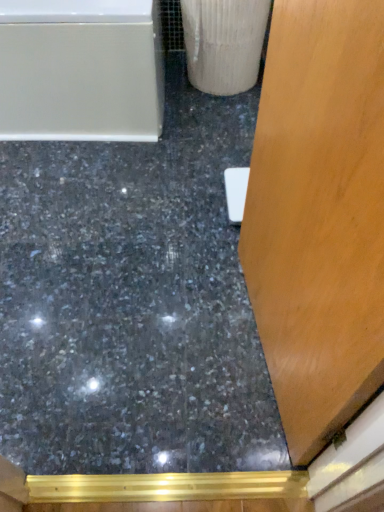
This screenshot has width=384, height=512. Describe the element at coordinates (81, 70) in the screenshot. I see `white glossy bathtub at upper left` at that location.

What is the approximate height of white glossy bathtub at upper left?

21.39 inches.

Locate an element on the screen. white glossy bathtub at upper left is located at coordinates pos(81,70).

The width and height of the screenshot is (384, 512). What do you see at coordinates (132, 301) in the screenshot?
I see `shiny black concrete at center` at bounding box center [132, 301].

At what (x,y) coordinates should I click in order to perform the action: click on shiny black concrete at center. Please return your answer as a coordinate pair (x, y). The width and height of the screenshot is (384, 512). Looking at the image, I should click on (132, 301).

Measure the distance between shiny black concrete at center and camera.

shiny black concrete at center is 1.05 meters from camera.

This screenshot has width=384, height=512. I want to click on white glossy bathtub at upper left, so click(81, 70).

In the scene shown: Which is more to the right, shiny black concrete at center or white glossy bathtub at upper left?

From the viewer's perspective, shiny black concrete at center appears more on the right side.

Considering the relative positions of shiny black concrete at center and white glossy bathtub at upper left in the image provided, is shiny black concrete at center in front of white glossy bathtub at upper left?

Yes, it is in front of white glossy bathtub at upper left.

Is point (231, 288) positioned after point (39, 13)?

No, it is not.

From the image's perspective, which object appears higher, shiny black concrete at center or white glossy bathtub at upper left?

white glossy bathtub at upper left.

From a real-world perspective, who is located higher, shiny black concrete at center or white glossy bathtub at upper left?

white glossy bathtub at upper left, from a real-world perspective.

Considering the sizes of objects shiny black concrete at center and white glossy bathtub at upper left in the image provided, who is wider, shiny black concrete at center or white glossy bathtub at upper left?

Wider between the two is shiny black concrete at center.

From their relative heights in the image, would you say shiny black concrete at center is taller or shorter than white glossy bathtub at upper left?

In the image, shiny black concrete at center appears to be shorter than white glossy bathtub at upper left.

Considering the sizes of objects shiny black concrete at center and white glossy bathtub at upper left in the image provided, who is bigger, shiny black concrete at center or white glossy bathtub at upper left?

white glossy bathtub at upper left.

Is shiny black concrete at center not within white glossy bathtub at upper left?

Yes, shiny black concrete at center is not within white glossy bathtub at upper left.

Is shiny black concrete at center touching white glossy bathtub at upper left?

No, shiny black concrete at center is not touching white glossy bathtub at upper left.

Is shiny black concrete at center oriented towards white glossy bathtub at upper left?

No, shiny black concrete at center is not aimed at white glossy bathtub at upper left.

Can you tell me how much shiny black concrete at center and white glossy bathtub at upper left differ in facing direction?

0.528 degrees.

How distant is shiny black concrete at center from white glossy bathtub at upper left?

shiny black concrete at center and white glossy bathtub at upper left are 17.73 inches apart from each other.

Find the location of a particular element. bathtub that is above the shiny black concrete at center (from a real-world perspective) is located at coordinates (81, 70).

Consider the image. Can you confirm if white glossy bathtub at upper left is positioned to the left of shiny black concrete at center?

Correct, you'll find white glossy bathtub at upper left to the left of shiny black concrete at center.

Is white glossy bathtub at upper left positioned behind shiny black concrete at center?

Yes, white glossy bathtub at upper left is further from the viewer.

Which is in front, point (117, 55) or point (82, 318)?

Positioned in front is point (82, 318).

From the image's perspective, who appears lower, white glossy bathtub at upper left or shiny black concrete at center?

shiny black concrete at center.

From a real-world perspective, which is physically below, white glossy bathtub at upper left or shiny black concrete at center?

shiny black concrete at center, from a real-world perspective.

From the picture: Can you confirm if white glossy bathtub at upper left is thinner than shiny black concrete at center?

Indeed, white glossy bathtub at upper left has a lesser width compared to shiny black concrete at center.

Who is shorter, white glossy bathtub at upper left or shiny black concrete at center?

With less height is shiny black concrete at center.

Considering the relative sizes of white glossy bathtub at upper left and shiny black concrete at center in the image provided, is white glossy bathtub at upper left smaller than shiny black concrete at center?

No, white glossy bathtub at upper left is not smaller than shiny black concrete at center.

Choose the correct answer: Is white glossy bathtub at upper left inside shiny black concrete at center or outside it?

white glossy bathtub at upper left exists outside the volume of shiny black concrete at center.

Is the surface of white glossy bathtub at upper left in direct contact with shiny black concrete at center?

No.

From the picture: Is white glossy bathtub at upper left aimed at shiny black concrete at center?

Yes, white glossy bathtub at upper left faces towards shiny black concrete at center.

Measure the distance from white glossy bathtub at upper left to shiny black concrete at center.

white glossy bathtub at upper left is 17.73 inches from shiny black concrete at center.

At what (x,y) coordinates should I click in order to perform the action: click on bathtub behind the shiny black concrete at center. Please return your answer as a coordinate pair (x, y). Looking at the image, I should click on (81, 70).

Identify the location of concrete below the white glossy bathtub at upper left (from the image's perspective). The height and width of the screenshot is (512, 384). (132, 301).

This screenshot has width=384, height=512. Find the location of `bathtub above the shiny black concrete at center (from the image's perspective)`. bathtub above the shiny black concrete at center (from the image's perspective) is located at coordinates (81, 70).